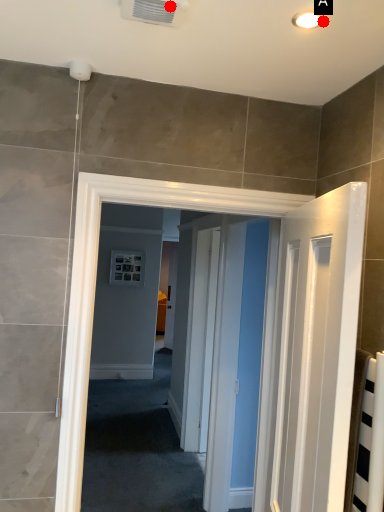
Question: Two points are circled on the image, labeled by A and B beside each circle. Which point is farther from the camera taking this photo?

Choices:
 (A) A is further
 (B) B is further

Answer: (A)